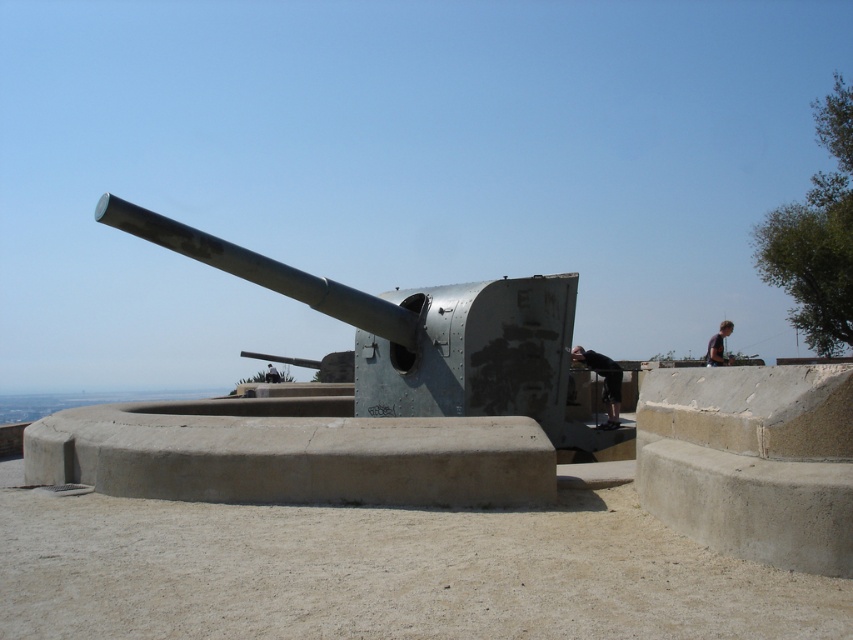
Question: Is shiny metallic cannon at center closer to camera compared to dark blue shirt at upper right?

Choices:
 (A) yes
 (B) no

Answer: (A)

Question: Which point is closer to the camera?

Choices:
 (A) (189, 250)
 (B) (604, 387)

Answer: (A)

Question: Which is farther from the shiny metallic cannon at center?

Choices:
 (A) dark blue shirt at upper right
 (B) black matte pants at lower center

Answer: (A)

Question: Is shiny metallic cannon at center closer to camera compared to dark blue shirt at upper right?

Choices:
 (A) no
 (B) yes

Answer: (B)

Question: Estimate the real-world distances between objects in this image. Which object is farther from the shiny metallic cannon at center?

Choices:
 (A) dark blue shirt at upper right
 (B) black matte pants at lower center

Answer: (A)

Question: Does shiny metallic cannon at center have a lesser width compared to dark blue shirt at upper right?

Choices:
 (A) yes
 (B) no

Answer: (A)